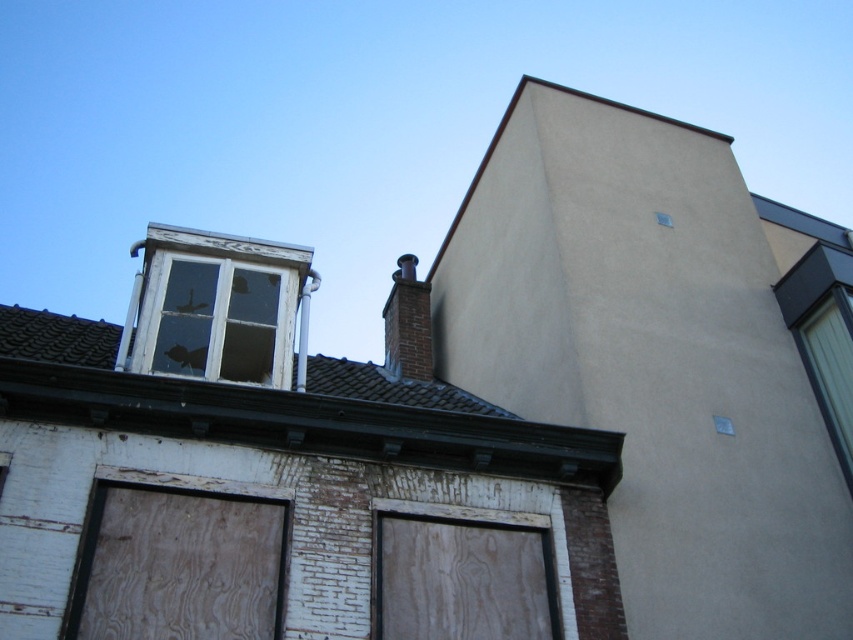
Is smooth gray slate roof at upper center thinner than brick chimney at upper center?

In fact, smooth gray slate roof at upper center might be wider than brick chimney at upper center.

Can you confirm if smooth gray slate roof at upper center is positioned below brick chimney at upper center?

Yes, smooth gray slate roof at upper center is below brick chimney at upper center.

Is point (45, 369) less distant than point (395, 362)?

Yes, point (45, 369) is closer to viewer.

Where is `smooth gray slate roof at upper center`? This screenshot has width=853, height=640. smooth gray slate roof at upper center is located at coordinates (286, 406).

Between point (227, 262) and point (395, 342), which one is positioned in front?

Positioned in front is point (227, 262).

Is white wooden window at upper left taller than brick chimney at upper center?

In fact, white wooden window at upper left may be shorter than brick chimney at upper center.

Is point (194, 284) positioned behind point (404, 269)?

No.

Find the location of a particular element. This screenshot has height=640, width=853. white wooden window at upper left is located at coordinates (218, 305).

Who is positioned more to the left, smooth gray slate roof at upper center or white wooden window at upper left?

white wooden window at upper left

Does smooth gray slate roof at upper center appear under white wooden window at upper left?

Correct, smooth gray slate roof at upper center is located below white wooden window at upper left.

Between point (151, 429) and point (202, 321), which one is positioned in front?

Point (151, 429)

Image resolution: width=853 pixels, height=640 pixels. Find the location of `smooth gray slate roof at upper center`. smooth gray slate roof at upper center is located at coordinates (286, 406).